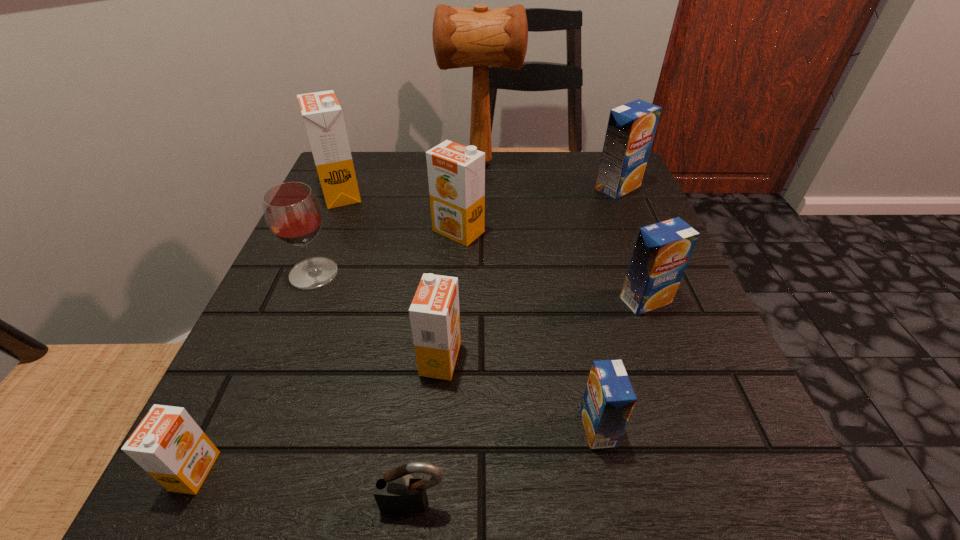
Identify which object is the second nearest to the fifth orange juice from left to right. Please provide its 2D coordinates. Your answer should be formatted as a tuple, i.e. [(x, y)], where the tuple contains the x and y coordinates of a point satisfying the conditions above.

[(398, 491)]

This screenshot has height=540, width=960. Find the location of `orange juice that is the fourth closest to the third object from right to left`. orange juice that is the fourth closest to the third object from right to left is located at coordinates (168, 444).

I want to click on the closest orange juice relative to the leftmost blue orange_juice, so click(434, 313).

Locate an element on the screen. The height and width of the screenshot is (540, 960). orange orange juice that stands as the closest to the tallest object is located at coordinates (322, 114).

Find the location of a particular element. This screenshot has width=960, height=540. the second closest orange orange juice to the biggest blue orange_juice is located at coordinates (434, 313).

Point out which blue orange_juice is positioned as the nearest to the biggest orange orange juice. Please provide its 2D coordinates. Your answer should be formatted as a tuple, i.e. [(x, y)], where the tuple contains the x and y coordinates of a point satisfying the conditions above.

[(631, 127)]

You are a GUI agent. You are given a task and a screenshot of the screen. Output one action in this format:
    pyautogui.click(x=<x>, y=<y>)
    Task: Click on the blue orange_juice that is the third nearest to the biggest orange orange juice
    
    Given the screenshot: What is the action you would take?
    pyautogui.click(x=609, y=398)

The height and width of the screenshot is (540, 960). What are the coordinates of `vacant space that satisfies the following two spatial constraints: 1. on the strike surface of the mallet; 2. on the front side of the red wineglass` in the screenshot? It's located at (480, 273).

I want to click on free space in the image that satisfies the following two spatial constraints: 1. on the back side of the fourth nearest orange juice; 2. on the left side of the biggest blue orange_juice, so click(x=603, y=188).